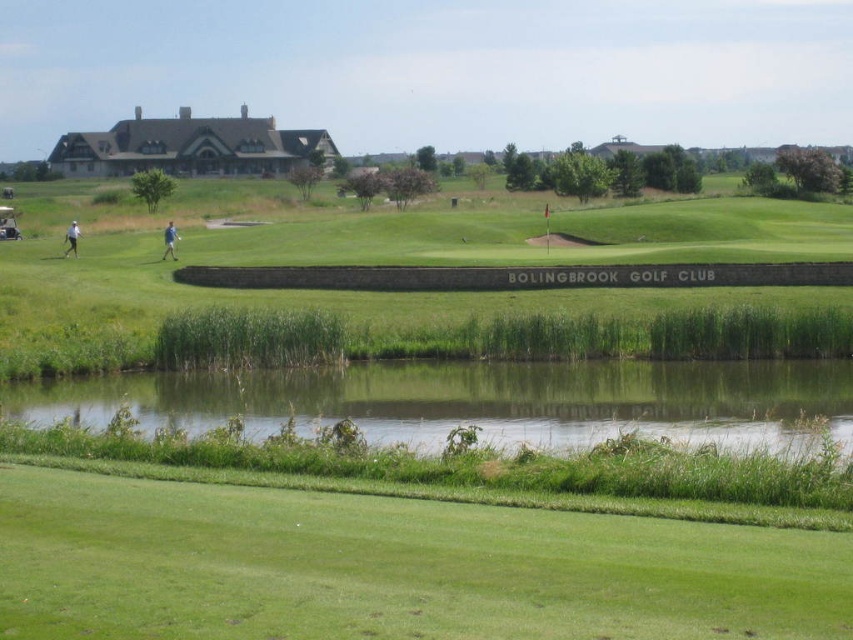
Question: Does green grass at upper center appear under white fabric person at left?

Choices:
 (A) yes
 (B) no

Answer: (B)

Question: Is green grass at upper center below blue fabric person at center-left?

Choices:
 (A) yes
 (B) no

Answer: (B)

Question: Which point is closer to the camera?

Choices:
 (A) white fabric person at left
 (B) green grass at upper center
 (C) blue fabric person at center-left
 (D) green liquid water at center

Answer: (B)

Question: Estimate the real-world distances between objects in this image. Which object is farther from the green liquid water at center?

Choices:
 (A) green grass at upper center
 (B) white fabric person at left

Answer: (B)

Question: Can you confirm if green grass at upper center is wider than blue fabric person at center-left?

Choices:
 (A) yes
 (B) no

Answer: (A)

Question: Which object is farther from the camera taking this photo?

Choices:
 (A) green grass at upper center
 (B) white fabric person at left

Answer: (B)